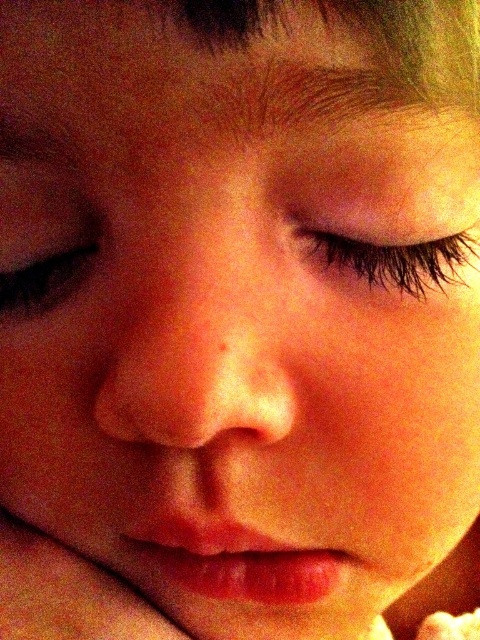
You are a photographer adjusting the focus on a portrait. You notice the black eyelashes at center and the brown matte eye at left in your viewfinder. Which object should you adjust the focus towards if you want to ensure the taller one is in sharp detail?

The brown matte eye at left is taller than the black eyelashes at center, so you should adjust the focus towards the brown matte eye at left to ensure it is in sharp detail.

You are a photographer adjusting the focus on a portrait. The subject has their lips closed and mouth slightly parted. You notice a point at coordinates (396, 259). Based on the scene description, where is this point located?

The point at coordinates (396, 259) is located on the black eyelashes at center.